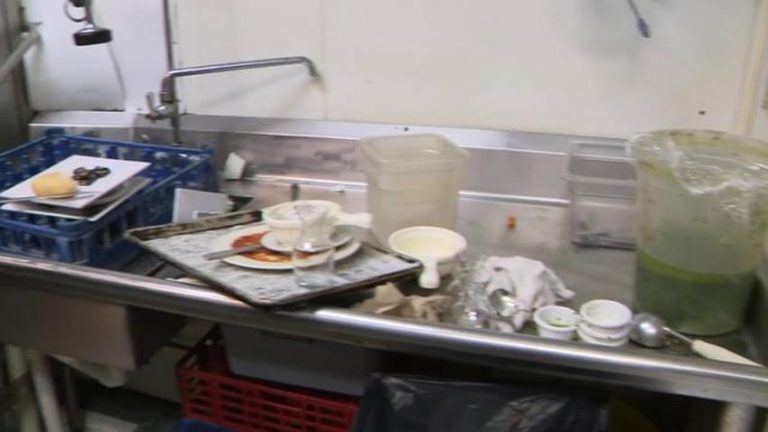
Where is `wall`? The width and height of the screenshot is (768, 432). wall is located at coordinates (535, 68).